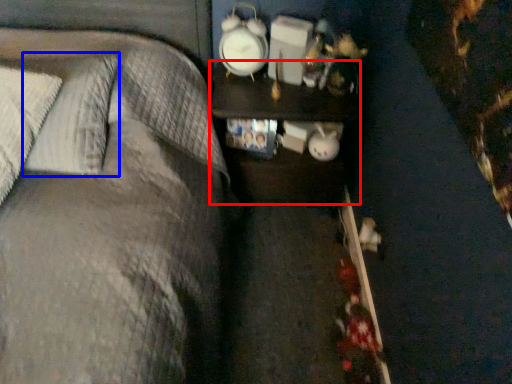
Question: Which point is closer to the camera, nightstand (highlighted by a red box) or pillow (highlighted by a blue box)?

Choices:
 (A) nightstand
 (B) pillow

Answer: (B)